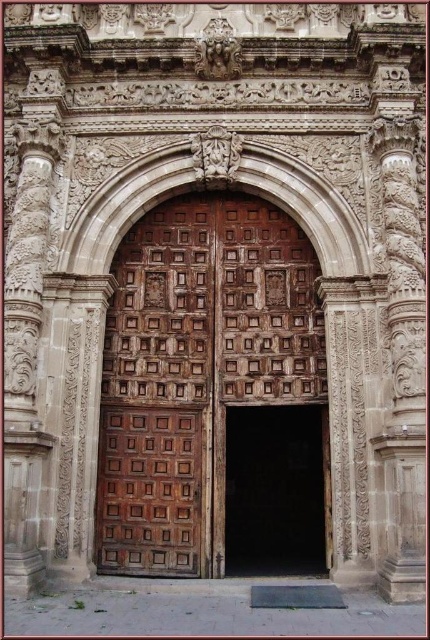
Who is lower down, wooden carved door at center or brown wood door at center?

brown wood door at center is lower down.

Based on the photo, does wooden carved door at center lie behind brown wood door at center?

No, wooden carved door at center is closer to the viewer.

Between point (123, 460) and point (291, 426), which one is positioned behind?

Point (291, 426)

The image size is (430, 640). I want to click on wooden carved door at center, so click(x=196, y=371).